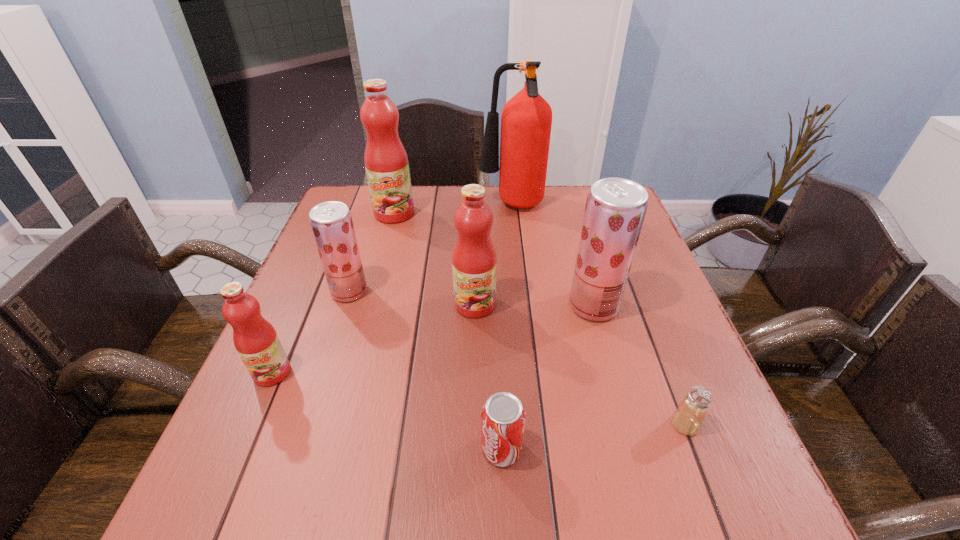
Image resolution: width=960 pixels, height=540 pixels. What are the coordinates of `vacant space that satisfies the following two spatial constraints: 1. at the nozzle of the fire extinguisher; 2. on the left side of the shortest object` in the screenshot? It's located at (533, 424).

Find the location of a particular element. vacant space that satisfies the following two spatial constraints: 1. at the nozzle of the fire extinguisher; 2. on the back side of the second object from right to left is located at coordinates (521, 306).

Find the location of `blank area in the image that satisfies the following two spatial constraints: 1. on the front label of the second smallest pink fruit juice; 2. on the right side of the soda can`. blank area in the image that satisfies the following two spatial constraints: 1. on the front label of the second smallest pink fruit juice; 2. on the right side of the soda can is located at coordinates (473, 449).

At what (x,y) coordinates should I click in order to perform the action: click on blank space that satisfies the following two spatial constraints: 1. on the back side of the rightmost object; 2. at the nozzle of the red fire extinguisher. Please return your answer as a coordinate pair (x, y). The width and height of the screenshot is (960, 540). Looking at the image, I should click on (601, 206).